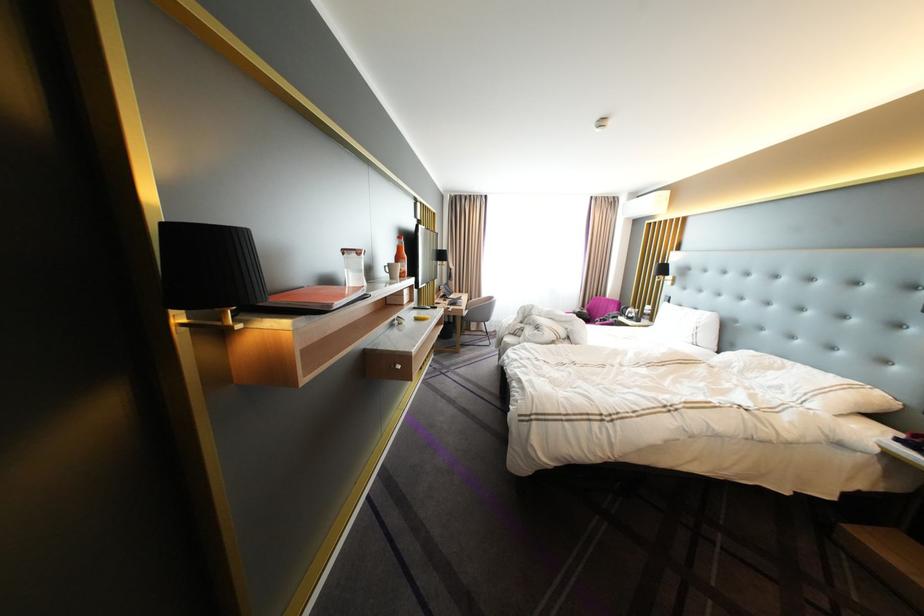
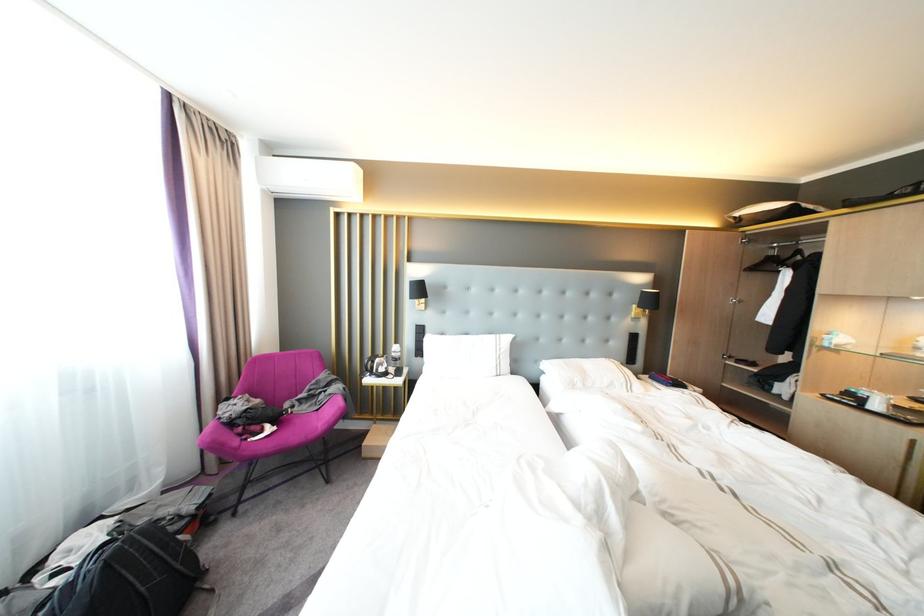
In the second image, find the point that corresponds to the point at 638,310 in the first image.

(384, 363)